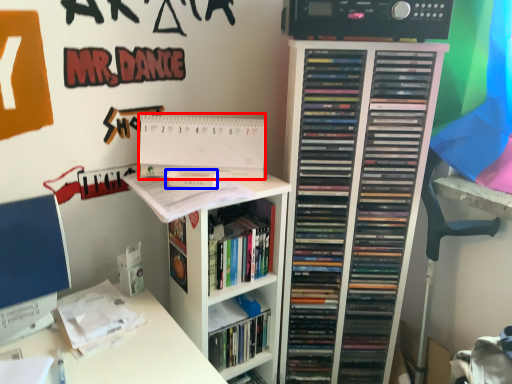
Question: Which object appears closest to the camera in this image, paperback book (highlighted by a red box) or paperback book (highlighted by a blue box)?

Choices:
 (A) paperback book
 (B) paperback book

Answer: (B)